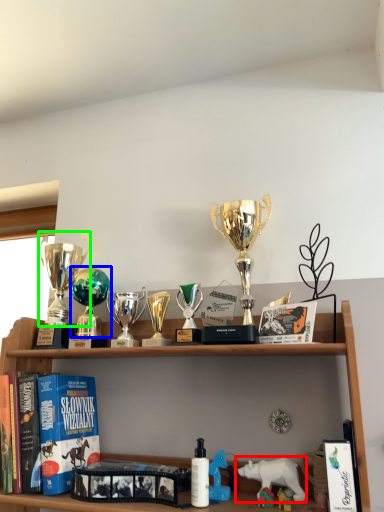
Question: Considering the real-world distances, which object is closest to animal (highlighted by a red box)? toy (highlighted by a blue box) or trophy (highlighted by a green box).

Choices:
 (A) toy
 (B) trophy

Answer: (A)